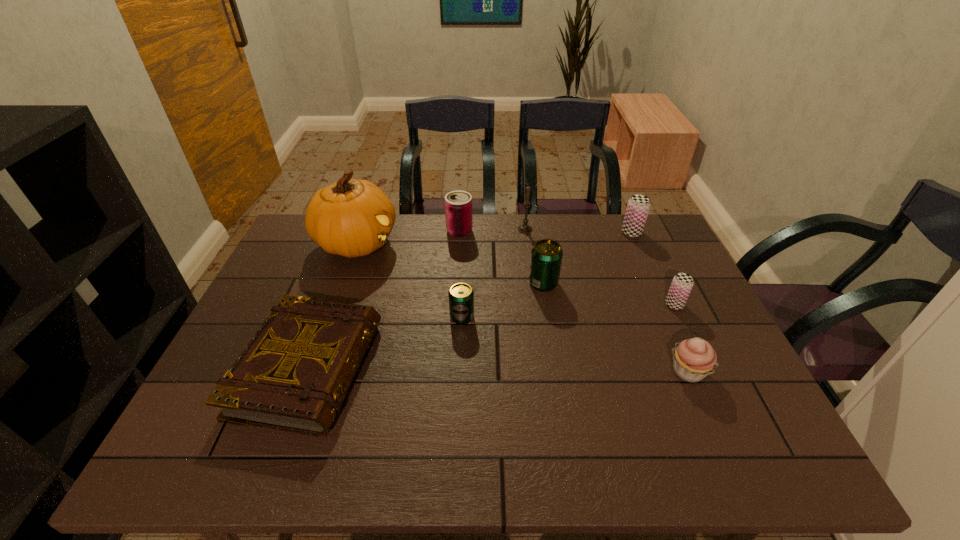
Identify the location of vacant area situated 0.400m on the front of the smaller purple beer can. The height and width of the screenshot is (540, 960). pyautogui.click(x=742, y=449).

Find the location of a particular element. blank space located on the back of the leftmost beer can is located at coordinates (464, 280).

Locate an element on the screen. This screenshot has height=540, width=960. vacant region located 0.150m on the back of the shortest object is located at coordinates 342,278.

Locate an element on the screen. The image size is (960, 540). pumpkin positioned at the far edge is located at coordinates (352, 218).

This screenshot has width=960, height=540. What are the coordinates of `candle situated at the far edge` in the screenshot? It's located at (524, 228).

Locate an element on the screen. This screenshot has width=960, height=540. can that is at the far edge is located at coordinates (458, 204).

Identify the location of beer can present at the far edge. Image resolution: width=960 pixels, height=540 pixels. (638, 206).

The image size is (960, 540). Find the location of `object at the near edge`. object at the near edge is located at coordinates (294, 374).

Locate an element on the screen. The height and width of the screenshot is (540, 960). pumpkin at the left edge is located at coordinates (352, 218).

Where is `hardback book situated at the left edge`? hardback book situated at the left edge is located at coordinates (294, 374).